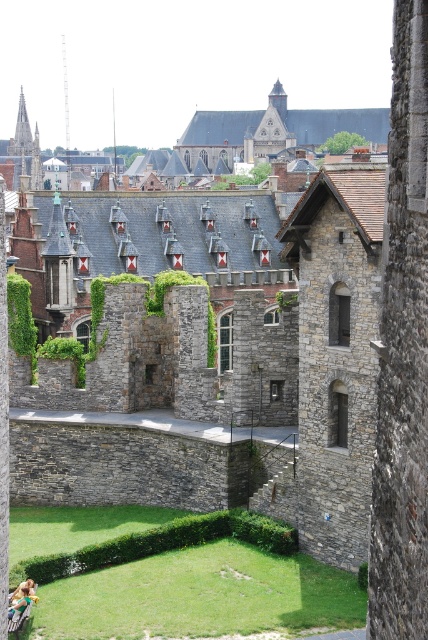
Question: Can you confirm if green grass at lower center is bigger than wooden park bench at lower left?

Choices:
 (A) no
 (B) yes

Answer: (B)

Question: Is green grass at lower center further to camera compared to wooden park bench at lower left?

Choices:
 (A) no
 (B) yes

Answer: (B)

Question: Among these objects, which one is farthest from the camera?

Choices:
 (A) smooth stone spire at upper left
 (B) green grass at lower center

Answer: (A)

Question: Which of the following is the closest to the observer?

Choices:
 (A) (8, 616)
 (B) (23, 173)
 (C) (146, 550)

Answer: (A)

Question: Based on their relative distances, which object is farther from the green grass at lower center?

Choices:
 (A) wooden park bench at lower left
 (B) smooth stone spire at upper left

Answer: (B)

Question: Considering the relative positions of smooth stone spire at upper left and wooden park bench at lower left in the image provided, where is smooth stone spire at upper left located with respect to wooden park bench at lower left?

Choices:
 (A) left
 (B) right

Answer: (A)